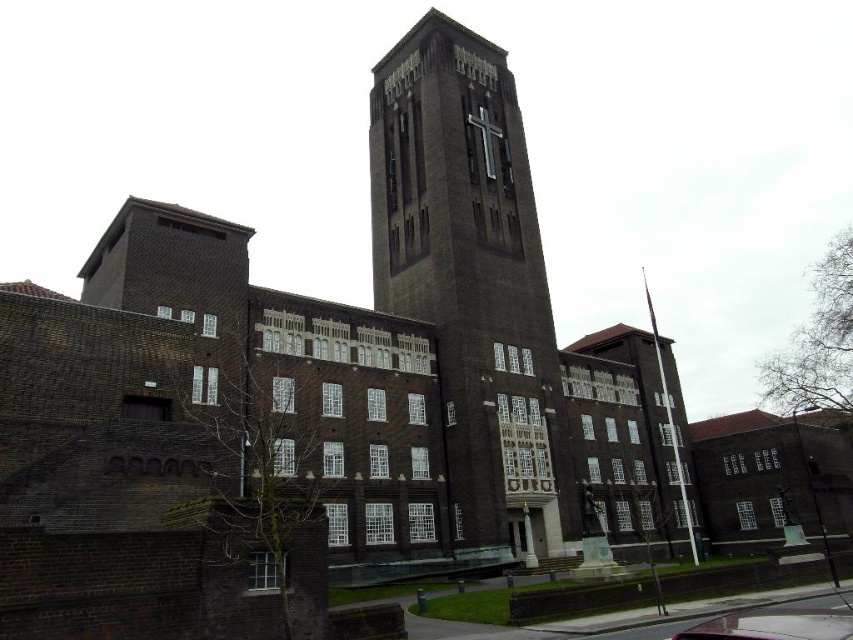
Question: Is brown brick tower at center below metallic pink car at lower center?

Choices:
 (A) yes
 (B) no

Answer: (B)

Question: Can you confirm if brown brick tower at center is positioned below metallic pink car at lower center?

Choices:
 (A) yes
 (B) no

Answer: (B)

Question: Can you confirm if brown brick tower at center is positioned below metallic pink car at lower center?

Choices:
 (A) no
 (B) yes

Answer: (A)

Question: Which point appears farthest from the camera in this image?

Choices:
 (A) (445, 113)
 (B) (724, 621)

Answer: (A)